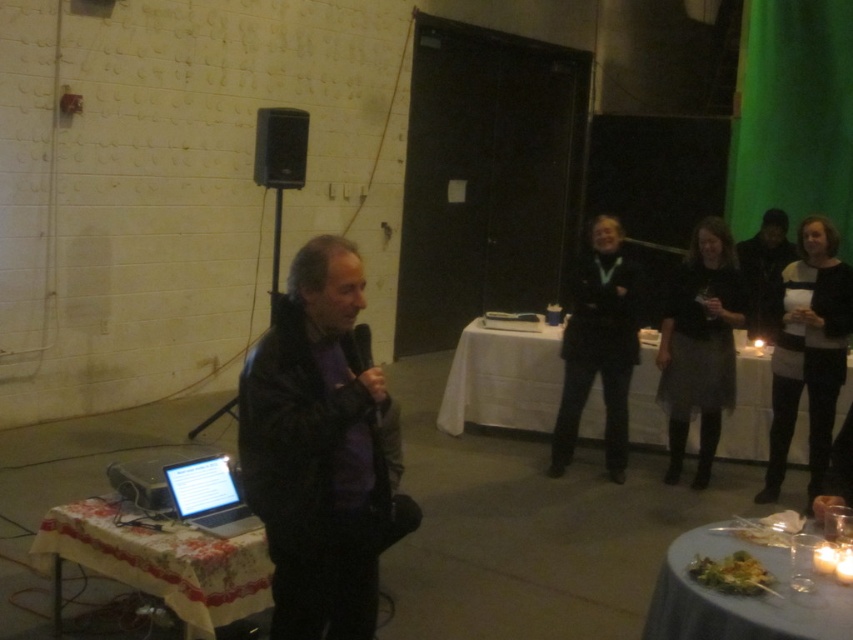
Does silver metallic laptop at lower left have a lesser width compared to black matte microphone at center?

In fact, silver metallic laptop at lower left might be wider than black matte microphone at center.

This screenshot has width=853, height=640. I want to click on silver metallic laptop at lower left, so click(209, 497).

This screenshot has width=853, height=640. In order to click on silver metallic laptop at lower left in this screenshot , I will do `click(209, 497)`.

Which is above, dark gray skirt at right or silver metallic laptop at lower left?

dark gray skirt at right is above.

What are the coordinates of `dark gray skirt at right` in the screenshot? It's located at (699, 346).

Can you confirm if dark leather jacket at center is shorter than silver metallic laptop at lower left?

No.

Is dark leather jacket at center to the right of silver metallic laptop at lower left from the viewer's perspective?

Correct, you'll find dark leather jacket at center to the right of silver metallic laptop at lower left.

Is point (314, 381) closer to viewer compared to point (207, 490)?

Yes, point (314, 381) is in front of point (207, 490).

Find the location of a particular element. The width and height of the screenshot is (853, 640). dark leather jacket at center is located at coordinates (317, 451).